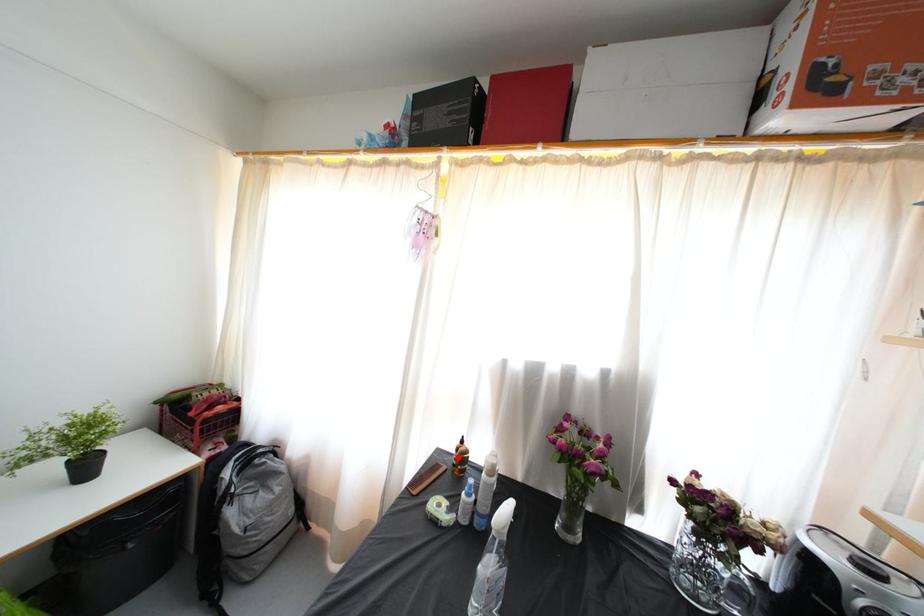
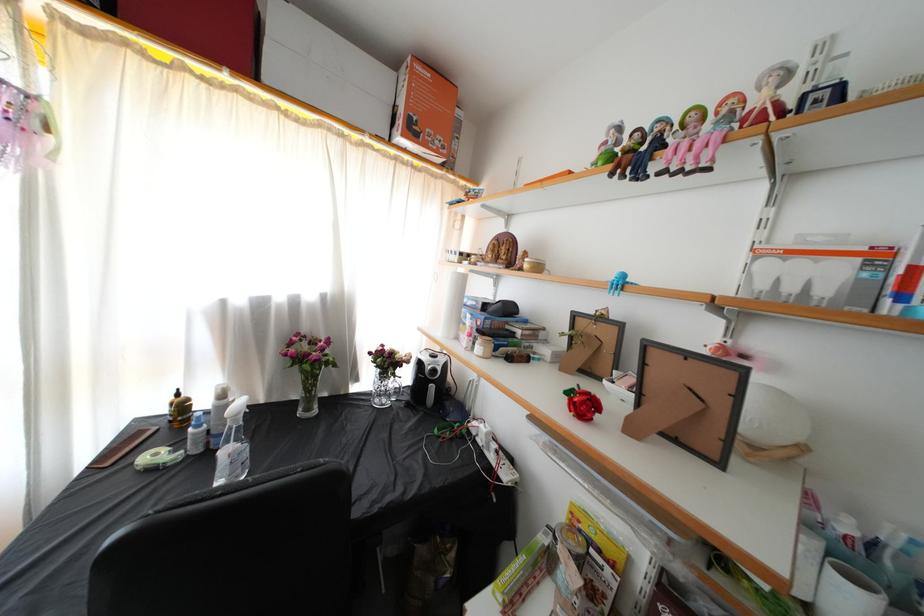
Question: I am providing you with two images of the same scene from different viewpoints. Image1 has a red point marked. In image2, the corresponding 3D location appears at what relative position? Reply with the corresponding letter.

Choices:
 (A) Closer
 (B) Farther

Answer: (A)